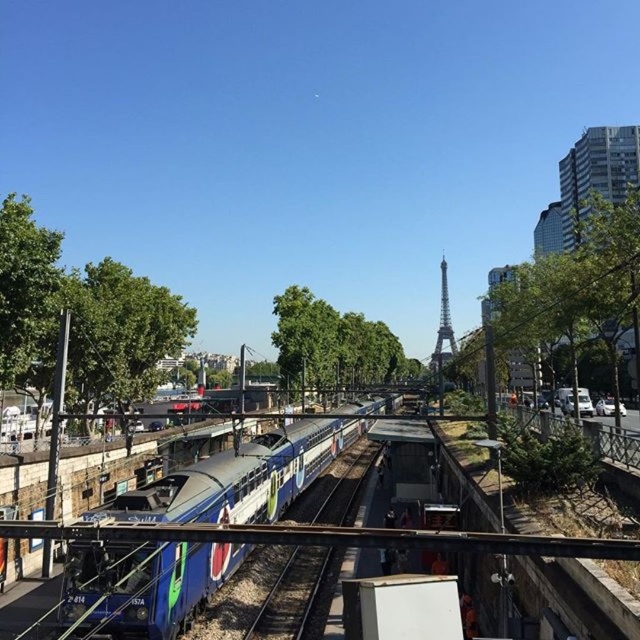
Is blue glossy train at center thinner than blue metallic train track at center?

Incorrect, blue glossy train at center's width is not less than blue metallic train track at center's.

Is point (218, 572) positioned before point (371, 468)?

Yes, point (218, 572) is in front of point (371, 468).

You are a GUI agent. You are given a task and a screenshot of the screen. Output one action in this format:
    pyautogui.click(x=<x>, y=<y>)
    Task: Click on the blue glossy train at center
    
    Given the screenshot: What is the action you would take?
    pyautogui.click(x=241, y=477)

Can you confirm if blue metallic train track at center is positioned to the left of metallic silver tower at center?

Indeed, blue metallic train track at center is positioned on the left side of metallic silver tower at center.

Which is behind, point (320, 609) or point (436, 387)?

The point (436, 387) is behind.

Is point (339, 524) behind point (452, 339)?

No, it is in front of (452, 339).

The image size is (640, 640). I want to click on blue metallic train track at center, so click(296, 596).

Can you confirm if blue glossy train at center is taller than metallic silver tower at center?

No, blue glossy train at center is not taller than metallic silver tower at center.

Which of these two, blue glossy train at center or metallic silver tower at center, stands shorter?

blue glossy train at center is shorter.

Which is in front, point (241, 492) or point (449, 333)?

Positioned in front is point (241, 492).

The image size is (640, 640). Find the location of `blue glossy train at center`. blue glossy train at center is located at coordinates (241, 477).